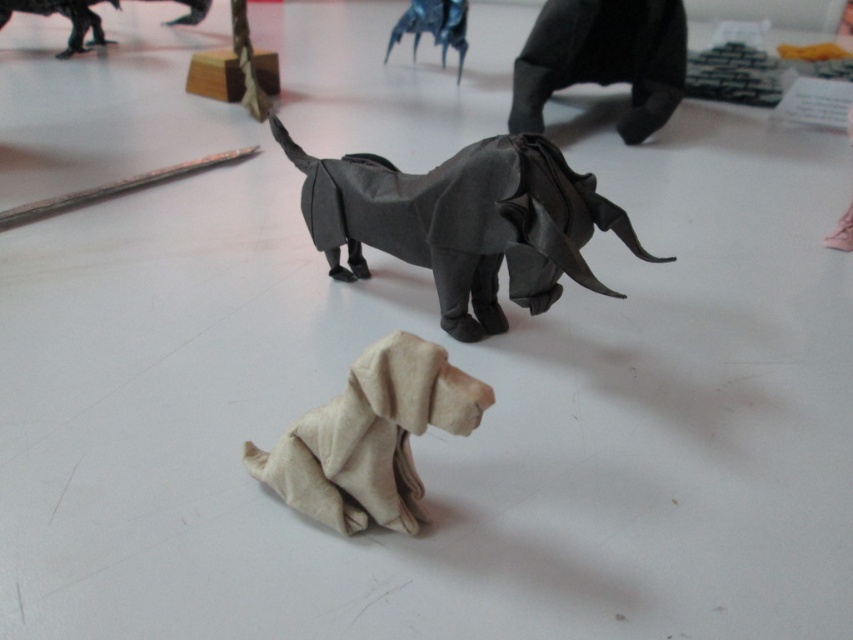
The height and width of the screenshot is (640, 853). Identify the location of matte gray origami elephant at upper right. (602, 60).

Can you confirm if matte gray origami elephant at upper right is shorter than metallic blue origami spider at upper center?

Incorrect, matte gray origami elephant at upper right's height does not fall short of metallic blue origami spider at upper center's.

Which is in front, point (544, 60) or point (415, 0)?

Positioned in front is point (544, 60).

This screenshot has width=853, height=640. I want to click on matte gray origami elephant at upper right, so click(x=602, y=60).

You are a GUI agent. You are given a task and a screenshot of the screen. Output one action in this format:
    pyautogui.click(x=<x>, y=<y>)
    Task: Click on the beige paper dog at lower center
    Image resolution: width=853 pixels, height=640 pixels.
    Given the screenshot: What is the action you would take?
    pyautogui.click(x=370, y=436)

Between beige paper dog at lower center and matte gray origami elephant at upper right, which one is positioned lower?

beige paper dog at lower center is below.

Between point (378, 365) and point (630, 12), which one is positioned behind?

The point (630, 12) is more distant.

Image resolution: width=853 pixels, height=640 pixels. Find the location of `beige paper dog at lower center`. beige paper dog at lower center is located at coordinates (370, 436).

Does matte gray origami elephant at upper right have a greater width compared to shiny metallic robot at upper left?

Correct, the width of matte gray origami elephant at upper right exceeds that of shiny metallic robot at upper left.

Is matte gray origami elephant at upper right taller than shiny metallic robot at upper left?

Indeed, matte gray origami elephant at upper right has a greater height compared to shiny metallic robot at upper left.

Which is behind, point (666, 67) or point (44, 10)?

Point (44, 10)

This screenshot has height=640, width=853. In order to click on matte gray origami elephant at upper right in this screenshot , I will do `click(602, 60)`.